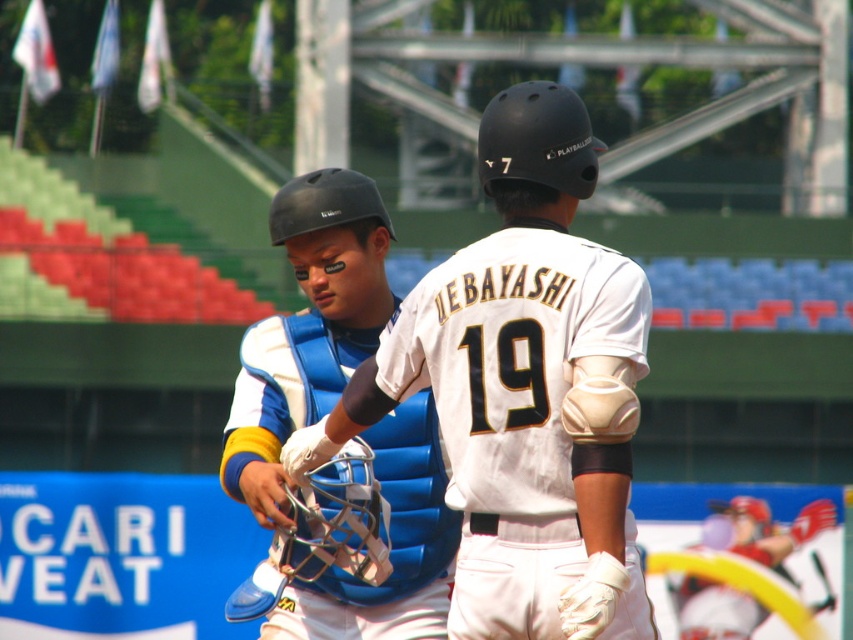
Question: Which of the following is the farthest from the observer?

Choices:
 (A) matte red helmet at lower right
 (B) white matte baseball glove at center

Answer: (A)

Question: Can you confirm if blue padded chest protector at center is positioned above matte red helmet at lower right?

Choices:
 (A) yes
 (B) no

Answer: (A)

Question: Estimate the real-world distances between objects in this image. Which object is closer to the matte red helmet at lower right?

Choices:
 (A) white matte baseball glove at center
 (B) blue padded chest protector at center

Answer: (B)

Question: Is blue padded chest protector at center above matte red helmet at lower right?

Choices:
 (A) no
 (B) yes

Answer: (B)

Question: Which object appears farthest from the camera in this image?

Choices:
 (A) white matte baseball glove at center
 (B) matte red helmet at lower right

Answer: (B)

Question: Can you confirm if blue padded chest protector at center is smaller than matte red helmet at lower right?

Choices:
 (A) no
 (B) yes

Answer: (A)